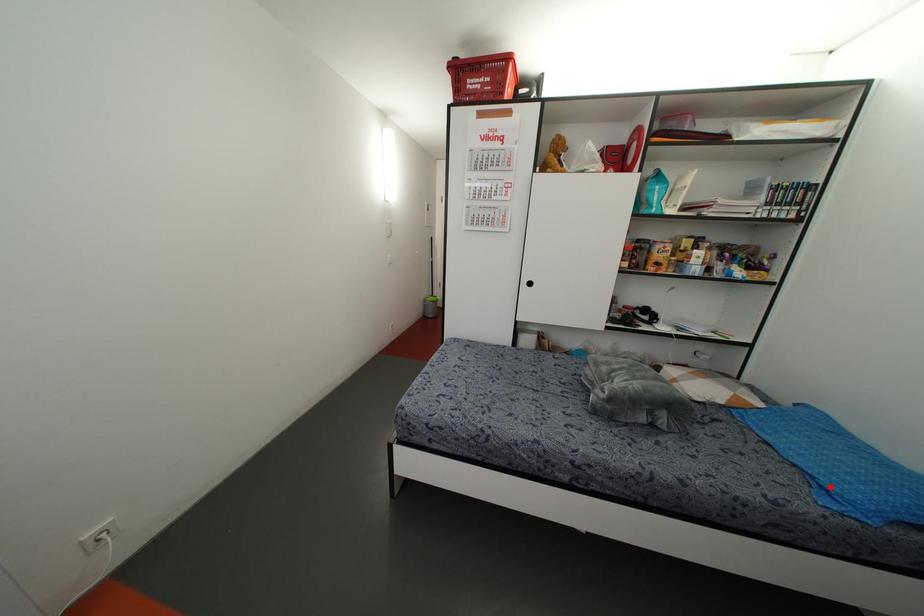
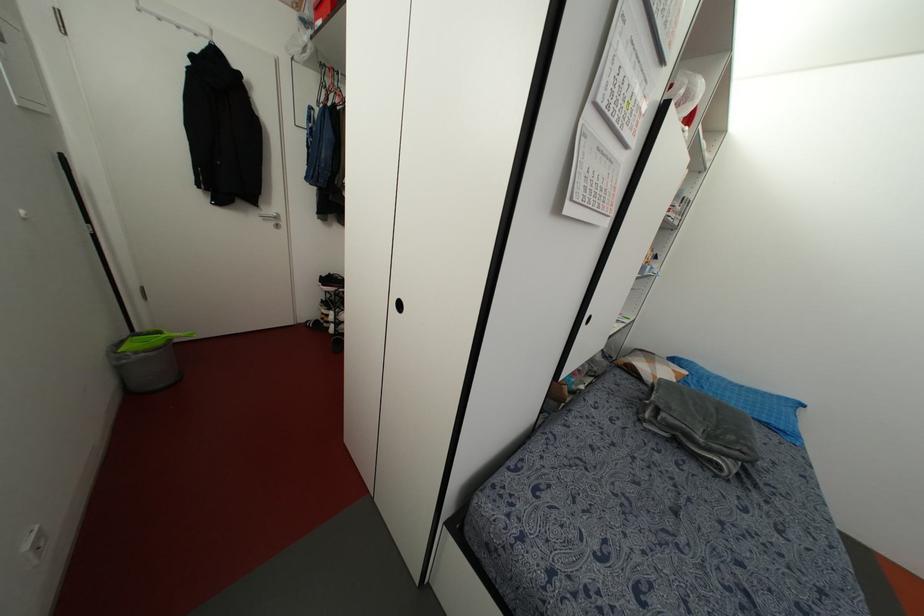
Question: A red point is marked in image1. In image2, is the corresponding 3D point closer to the camera or farther? Reply with the corresponding letter.

Choices:
 (A) The corresponding 3D point is closer.
 (B) The corresponding 3D point is farther.

Answer: (B)